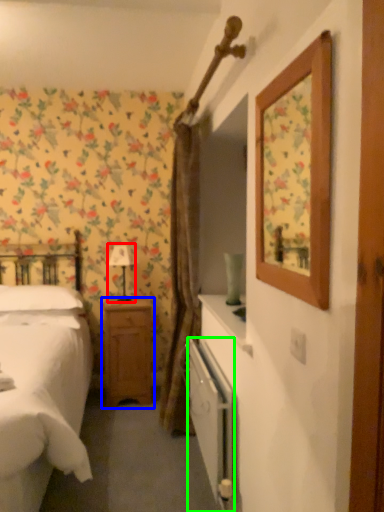
Question: Which is nearer to the table lamp (highlighted by a red box)? nightstand (highlighted by a blue box) or radiator (highlighted by a green box).

Choices:
 (A) nightstand
 (B) radiator

Answer: (A)